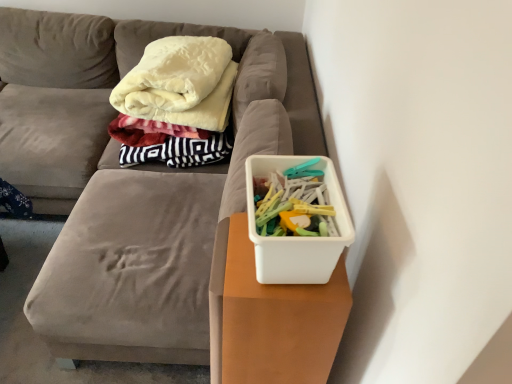
I want to click on white plastic container at center, so click(132, 180).

I want to click on white plastic container at right, so click(296, 237).

Would you say white plastic container at right is inside or outside white plastic container at center?

white plastic container at right is outside white plastic container at center.

Considering the sizes of objects white plastic container at right and white plastic container at center in the image provided, who is bigger, white plastic container at right or white plastic container at center?

white plastic container at center.

Looking at their sizes, would you say white plastic container at right is wider or thinner than white plastic container at center?

Considering their sizes, white plastic container at right looks slimmer than white plastic container at center.

How many degrees apart are the facing directions of white plastic container at right and white plastic container at center?

The facing directions of white plastic container at right and white plastic container at center are 0.000339 degrees apart.

Does white plastic container at right contain white plastic container at right?

No, white plastic container at right is located outside of white plastic container at right.

Considering the positions of objects white plastic container at right and white plastic container at right in the image provided, who is more to the left, white plastic container at right or white plastic container at right?

white plastic container at right.

From a real-world perspective, who is located lower, white plastic container at right or white plastic container at right?

white plastic container at right.

Is white plastic container at right turned away from white plastic container at right?

No, white plastic container at right is not facing away from white plastic container at right.

From the image's perspective, between white plastic container at right and white plastic container at right, which one is located above?

From the image's view, white plastic container at right is above.

Could you tell me if white plastic container at right is turned towards white plastic container at right?

No.

From a real-world perspective, is white plastic container at right over white plastic container at right?

No, from a real-world perspective, white plastic container at right is not above white plastic container at right.

Is white plastic container at right taller than white plastic container at right?

Yes.

At what (x,y) coordinates should I click in order to perform the action: click on storage box positioned vertically above the white plastic container at center (from a real-world perspective). Please return your answer as a coordinate pair (x, y). The image size is (512, 384). Looking at the image, I should click on (296, 237).

From a real-world perspective, is white plastic container at center positioned over white plastic container at right based on gravity?

No, from a real-world perspective, white plastic container at center is not over white plastic container at right

Are white plastic container at center and white plastic container at right making contact?

There is a gap between white plastic container at center and white plastic container at right.

From the image's perspective, is white plastic container at center above white plastic container at right?

Correct, white plastic container at center appears higher than white plastic container at right in the image.

Considering the relative sizes of white plastic container at center and white plastic container at right in the image provided, is white plastic container at center smaller than white plastic container at right?

No.

From a real-world perspective, is white plastic container at center under white plastic container at right?

Yes, from a real-world perspective, white plastic container at center is under white plastic container at right.

Is white plastic container at center thinner than white plastic container at right?

Incorrect, the width of white plastic container at center is not less than that of white plastic container at right.

Which of these two, white plastic container at right or white plastic container at center, is wider?

With larger width is white plastic container at center.

Considering the relative sizes of white plastic container at right and white plastic container at center in the image provided, is white plastic container at right shorter than white plastic container at center?

No.

Looking at this image, between white plastic container at right and white plastic container at center, which one appears on the left side from the viewer's perspective?

Positioned to the left is white plastic container at center.

How distant is white plastic container at right from white plastic container at center?

69.14 centimeters.

The width and height of the screenshot is (512, 384). Find the location of `furniture above the white plastic container at right (from the image's perspective)`. furniture above the white plastic container at right (from the image's perspective) is located at coordinates (132, 180).

What are the coordinates of `table located on the left of white plastic container at right` in the screenshot? It's located at (278, 320).

From the image, which object appears to be farther from white plastic container at right, white plastic container at center or white plastic container at right?

Based on the image, white plastic container at center appears to be further to white plastic container at right.

From the image, which object appears to be nearer to white plastic container at center, white plastic container at right or white plastic container at right?

The object closer to white plastic container at center is white plastic container at right.

Considering their positions, is white plastic container at center positioned further to white plastic container at right than white plastic container at right?

white plastic container at center lies further to white plastic container at right than the other object.

Which object lies nearer to the anchor point white plastic container at right, white plastic container at right or white plastic container at center?

white plastic container at right is positioned closer to the anchor white plastic container at right.

Looking at the image, which one is located further to white plastic container at right, white plastic container at right or white plastic container at center?

white plastic container at center.

From the picture: Estimate the real-world distances between objects in this image. Which object is closer to white plastic container at center, white plastic container at right or white plastic container at right?

Based on the image, white plastic container at right appears to be nearer to white plastic container at center.

Locate an element on the screen. This screenshot has width=512, height=384. storage box between white plastic container at center and white plastic container at right in the vertical direction is located at coordinates (296, 237).